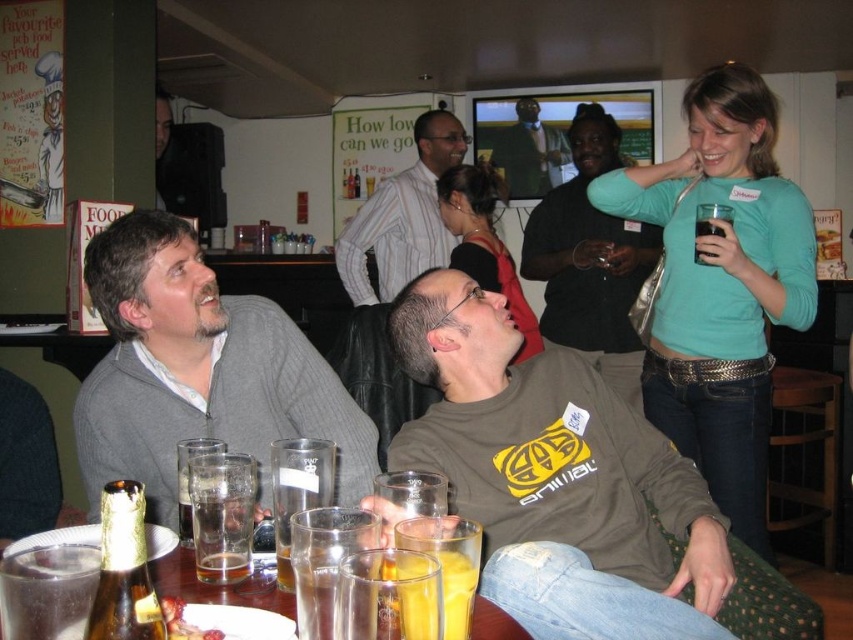
Question: Can you confirm if teal jersey at upper right is positioned above gray sweater at left?

Choices:
 (A) no
 (B) yes

Answer: (B)

Question: Can you confirm if striped shirt at center is wider than yellow translucent glass at lower center?

Choices:
 (A) no
 (B) yes

Answer: (B)

Question: Among these points, which one is farthest from the camera?

Choices:
 (A) (183, 563)
 (B) (747, 307)
 (C) (229, 563)
 (D) (477, 564)

Answer: (B)

Question: Which point is closer to the camera?

Choices:
 (A) dark brown liquid at upper right
 (B) gray sweater at left
 (C) clear glass at table center

Answer: (C)

Question: Where is gold foil beer bottle at lower left located in relation to translucent glassware at lower center in the image?

Choices:
 (A) left
 (B) right

Answer: (A)

Question: Estimate the real-world distances between objects in this image. Which object is farther from the teal jersey at upper right?

Choices:
 (A) matte black shirt at center
 (B) matte brown sweatshirt at center
 (C) translucent glassware at lower center

Answer: (C)